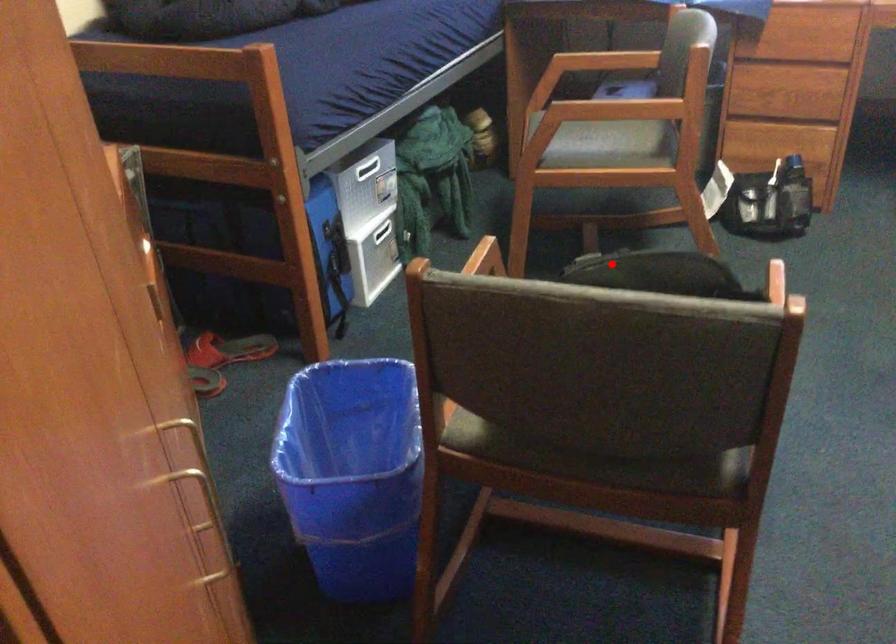
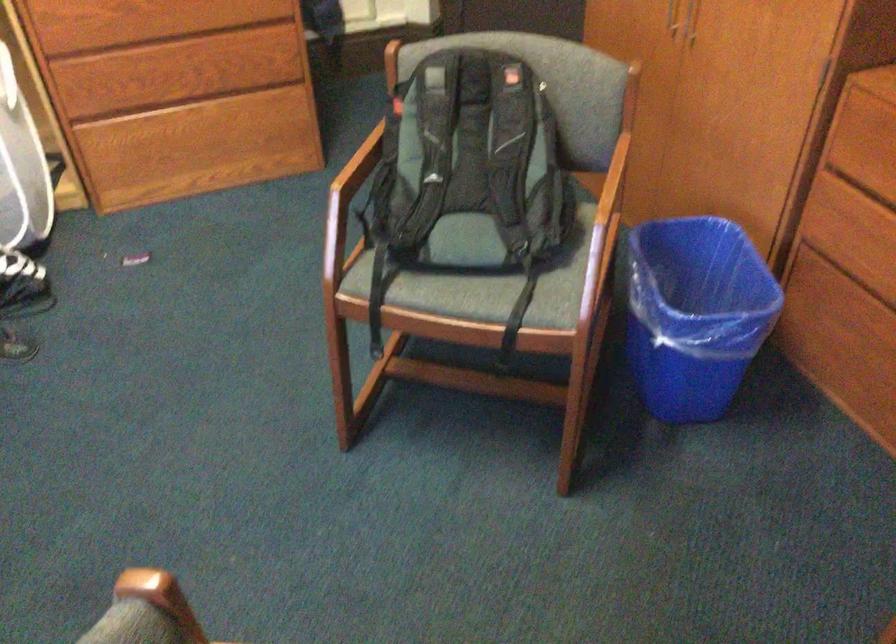
Find the pixel in the second image that matches the highlighted location in the first image.

(470, 62)